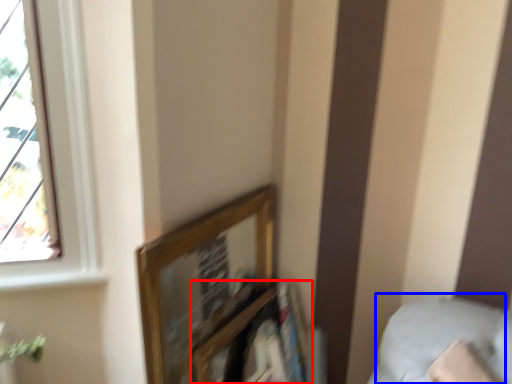
Question: Which point is closer to the camera, shelf (highlighted by a red box) or pillow (highlighted by a blue box)?

Choices:
 (A) shelf
 (B) pillow

Answer: (B)